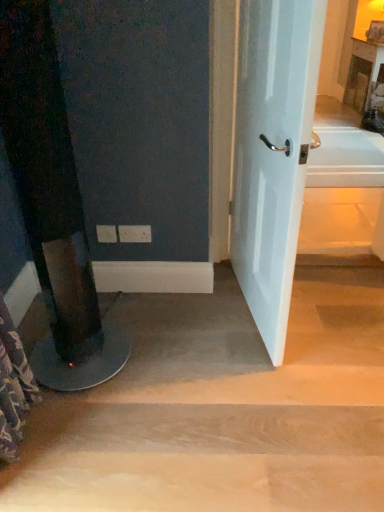
Where is `light brown wood at lower center`? The width and height of the screenshot is (384, 512). light brown wood at lower center is located at coordinates (223, 408).

Describe the element at coordinates (223, 408) in the screenshot. The image size is (384, 512). I see `light brown wood at lower center` at that location.

What is the approximate width of light brown wood at lower center?

light brown wood at lower center is 3.52 feet wide.

The height and width of the screenshot is (512, 384). What do you see at coordinates (273, 153) in the screenshot? I see `white glossy door at center` at bounding box center [273, 153].

Where is `white glossy door at center`? white glossy door at center is located at coordinates (273, 153).

In order to face white glossy door at center, should I rotate leftwards or rightwards?

You should look right and rotate roughly 9.151 degrees.

The height and width of the screenshot is (512, 384). Find the location of `light brown wood at lower center`. light brown wood at lower center is located at coordinates click(223, 408).

Can you confirm if white glossy door at center is positioned to the right of light brown wood at lower center?

Correct, you'll find white glossy door at center to the right of light brown wood at lower center.

Which object is further away from the camera, white glossy door at center or light brown wood at lower center?

light brown wood at lower center is further from the camera.

Which is more distant, (242, 62) or (145, 431)?

The point (242, 62) is farther.

From the image's perspective, which is below, white glossy door at center or light brown wood at lower center?

From the image's view, light brown wood at lower center is below.

From a real-world perspective, relative to light brown wood at lower center, is white glossy door at center vertically above or below?

Clearly, from a real-world perspective, white glossy door at center is above light brown wood at lower center.

Looking at their sizes, would you say white glossy door at center is wider or thinner than light brown wood at lower center?

Considering their sizes, white glossy door at center looks slimmer than light brown wood at lower center.

Consider the image. Is white glossy door at center shorter than light brown wood at lower center?

No.

Which of these two, white glossy door at center or light brown wood at lower center, is bigger?

light brown wood at lower center is bigger.

Is white glossy door at center positioned beyond the bounds of light brown wood at lower center?

white glossy door at center lies outside light brown wood at lower center's area.

Is white glossy door at center far from light brown wood at lower center?

white glossy door at center is near light brown wood at lower center, not far away.

Does white glossy door at center turn towards light brown wood at lower center?

No, white glossy door at center is not facing towards light brown wood at lower center.

At what (x,y) coordinates should I click in order to perform the action: click on stairwell below the white glossy door at center (from a real-world perspective). Please return your answer as a coordinate pair (x, y). The image size is (384, 512). Looking at the image, I should click on (223, 408).

Visually, is light brown wood at lower center positioned to the left or to the right of white glossy door at center?

Clearly, light brown wood at lower center is on the left of white glossy door at center in the image.

In the image, is light brown wood at lower center positioned in front of or behind white glossy door at center?

light brown wood at lower center is behind white glossy door at center.

Is point (310, 420) positioned behind point (266, 178)?

No, it is in front of (266, 178).

From the image's perspective, is light brown wood at lower center above or below white glossy door at center?

light brown wood at lower center is situated lower than white glossy door at center in the image.

From a real-world perspective, is light brown wood at lower center on white glossy door at center?

Incorrect, from a real-world perspective, light brown wood at lower center is lower than white glossy door at center.

Considering the sizes of objects light brown wood at lower center and white glossy door at center in the image provided, who is wider, light brown wood at lower center or white glossy door at center?

Wider between the two is light brown wood at lower center.

Is light brown wood at lower center taller or shorter than white glossy door at center?

light brown wood at lower center is shorter than white glossy door at center.

Who is bigger, light brown wood at lower center or white glossy door at center?

With larger size is light brown wood at lower center.

Is white glossy door at center located within light brown wood at lower center?

No, light brown wood at lower center does not contain white glossy door at center.

Based on the photo, is light brown wood at lower center not near white glossy door at center?

They are positioned close to each other.

Is light brown wood at lower center oriented towards white glossy door at center?

No.

How different are the orientations of light brown wood at lower center and white glossy door at center in degrees?

The facing directions of light brown wood at lower center and white glossy door at center are 78.4 degrees apart.

The image size is (384, 512). I want to click on door in front of the light brown wood at lower center, so click(x=273, y=153).

Where is `stairwell directly beneath the white glossy door at center (from a real-world perspective)`? This screenshot has height=512, width=384. stairwell directly beneath the white glossy door at center (from a real-world perspective) is located at coordinates (223, 408).

At what (x,y) coordinates should I click in order to perform the action: click on door that is in front of the light brown wood at lower center. Please return your answer as a coordinate pair (x, y). The width and height of the screenshot is (384, 512). Looking at the image, I should click on (273, 153).